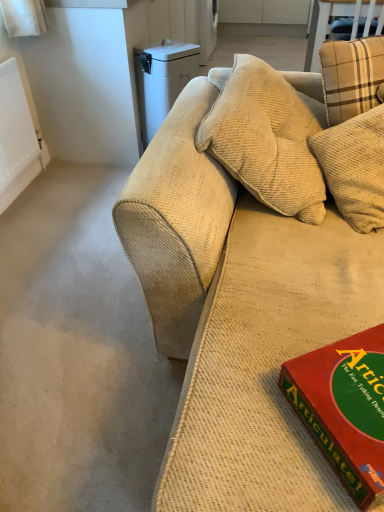
Question: From a real-world perspective, is white plastic trash can at upper left under red matte board game at lower right?

Choices:
 (A) yes
 (B) no

Answer: (A)

Question: Is red matte board game at lower right inside white plastic trash can at upper left?

Choices:
 (A) yes
 (B) no

Answer: (B)

Question: From a real-world perspective, is white plastic trash can at upper left over red matte board game at lower right?

Choices:
 (A) no
 (B) yes

Answer: (A)

Question: Can you confirm if white plastic trash can at upper left is bigger than red matte board game at lower right?

Choices:
 (A) no
 (B) yes

Answer: (B)

Question: Does white plastic trash can at upper left lie in front of red matte board game at lower right?

Choices:
 (A) no
 (B) yes

Answer: (A)

Question: Considering the relative sizes of white plastic trash can at upper left and red matte board game at lower right in the image provided, is white plastic trash can at upper left taller than red matte board game at lower right?

Choices:
 (A) no
 (B) yes

Answer: (B)

Question: Is white plastic trash can at upper left inside beige corduroy couch at center?

Choices:
 (A) no
 (B) yes

Answer: (A)

Question: From the image's perspective, would you say beige corduroy couch at center is positioned over white plastic trash can at upper left?

Choices:
 (A) no
 (B) yes

Answer: (B)

Question: From the image's perspective, does beige corduroy couch at center appear lower than white plastic trash can at upper left?

Choices:
 (A) yes
 (B) no

Answer: (B)

Question: From a real-world perspective, is beige corduroy couch at center positioned over white plastic trash can at upper left based on gravity?

Choices:
 (A) yes
 (B) no

Answer: (B)

Question: Is beige corduroy couch at center not inside white plastic trash can at upper left?

Choices:
 (A) no
 (B) yes

Answer: (B)

Question: Can you confirm if beige corduroy couch at center is smaller than white plastic trash can at upper left?

Choices:
 (A) no
 (B) yes

Answer: (A)

Question: Does red matte board game at lower right come behind beige corduroy couch at center?

Choices:
 (A) yes
 (B) no

Answer: (B)